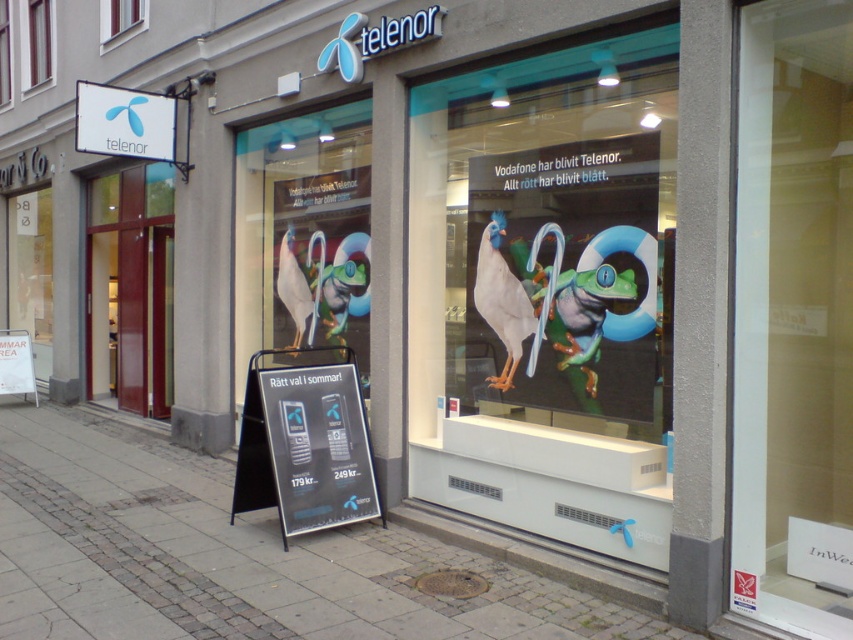
Question: Which object appears closest to the camera in this image?

Choices:
 (A) gray concrete pavement at lower center
 (B) white plastic sign at upper left

Answer: (A)

Question: Which object is farther from the camera taking this photo?

Choices:
 (A) white plastic sign at upper left
 (B) transparent glass window at upper center

Answer: (B)

Question: Where is gray concrete pavement at lower center located in relation to wooden frame at upper left in the image?

Choices:
 (A) below
 (B) above

Answer: (A)

Question: Estimate the real-world distances between objects in this image. Which object is closer to the white plastic sign at upper left?

Choices:
 (A) gray concrete pavement at lower center
 (B) transparent glass window at upper center
 (C) metallic silver phone at center
 (D) wooden frame at upper left

Answer: (C)

Question: Is metallic silver phone at center below transparent glass window at upper center?

Choices:
 (A) no
 (B) yes

Answer: (B)

Question: Does matte glass window at center come behind metallic silver phone at center?

Choices:
 (A) yes
 (B) no

Answer: (A)